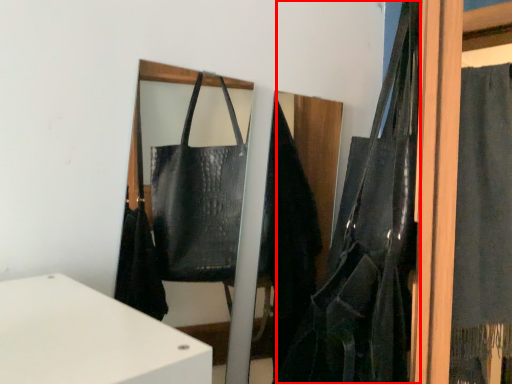
Question: From the image's perspective, where is shoulder bag (annotated by the red box) located relative to curtain?

Choices:
 (A) above
 (B) below

Answer: (A)